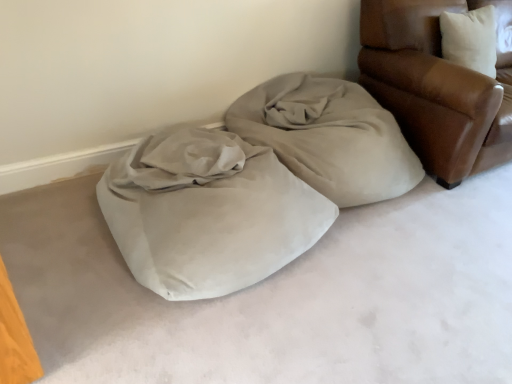
Question: Is suede-like beige bean bag at center aimed at leather armchair at upper right?

Choices:
 (A) yes
 (B) no

Answer: (B)

Question: Does suede-like beige bean bag at center have a greater width compared to leather armchair at upper right?

Choices:
 (A) yes
 (B) no

Answer: (A)

Question: From the image's perspective, does suede-like beige bean bag at center appear lower than leather armchair at upper right?

Choices:
 (A) yes
 (B) no

Answer: (A)

Question: Is suede-like beige bean bag at center not within leather armchair at upper right?

Choices:
 (A) no
 (B) yes

Answer: (B)

Question: Can you confirm if suede-like beige bean bag at center is taller than leather armchair at upper right?

Choices:
 (A) yes
 (B) no

Answer: (B)

Question: In the image, is suede-like beige bean bag at center positioned in front of or behind leather armchair at upper right?

Choices:
 (A) behind
 (B) front

Answer: (B)

Question: From the image's perspective, is suede-like beige bean bag at center located above or below leather armchair at upper right?

Choices:
 (A) below
 (B) above

Answer: (A)

Question: Is point (308, 92) closer or farther from the camera than point (475, 145)?

Choices:
 (A) closer
 (B) farther

Answer: (B)

Question: In terms of width, does suede-like beige bean bag at center look wider or thinner when compared to leather armchair at upper right?

Choices:
 (A) wide
 (B) thin

Answer: (A)

Question: Relative to suede-like beige bean bag at center, is leather armchair at upper right in front or behind?

Choices:
 (A) front
 (B) behind

Answer: (B)

Question: Is leather armchair at upper right inside or outside of suede-like beige bean bag at center?

Choices:
 (A) outside
 (B) inside

Answer: (A)

Question: Does point (470, 99) appear closer or farther from the camera than point (145, 206)?

Choices:
 (A) farther
 (B) closer

Answer: (A)

Question: Is leather armchair at upper right taller or shorter than suede-like beige bean bag at center?

Choices:
 (A) short
 (B) tall

Answer: (B)

Question: Do you think beige fabric at center is within suede-like beige bean bag at center, or outside of it?

Choices:
 (A) outside
 (B) inside

Answer: (A)

Question: In the image, is beige fabric at center positioned in front of or behind suede-like beige bean bag at center?

Choices:
 (A) behind
 (B) front

Answer: (A)